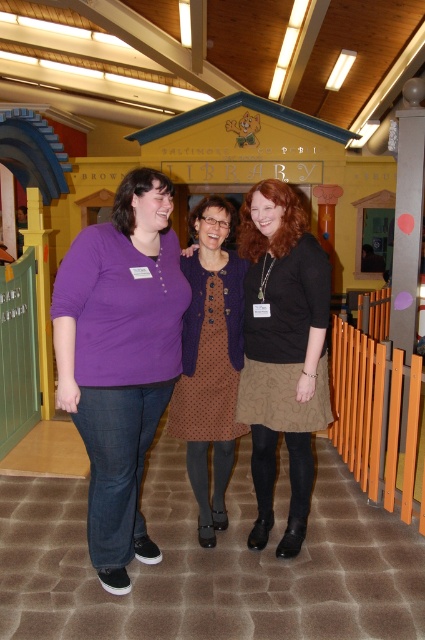
Question: Does brown textured dress at center have a larger size compared to brown dotted dress at center?

Choices:
 (A) yes
 (B) no

Answer: (B)

Question: Based on their relative distances, which object is nearer to the purple cotton shirt at center?

Choices:
 (A) brown dotted dress at center
 (B) brown textured dress at center

Answer: (A)

Question: Which object appears farthest from the camera in this image?

Choices:
 (A) brown dotted dress at center
 (B) brown textured dress at center
 (C) purple cotton shirt at center

Answer: (A)

Question: Which of the following is the closest to the observer?

Choices:
 (A) brown textured dress at center
 (B) purple cotton shirt at center
 (C) brown dotted dress at center

Answer: (B)

Question: Can you confirm if purple cotton shirt at center is thinner than brown dotted dress at center?

Choices:
 (A) no
 (B) yes

Answer: (A)

Question: Is brown textured dress at center bigger than brown dotted dress at center?

Choices:
 (A) no
 (B) yes

Answer: (A)